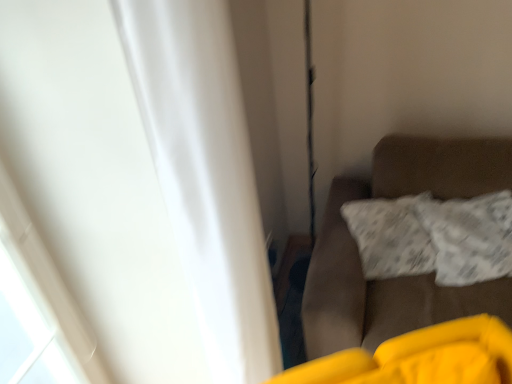
Question: Is white matte curtain at left facing away from brown fabric couch at right?

Choices:
 (A) no
 (B) yes

Answer: (A)

Question: Does white matte curtain at left have a smaller size compared to brown fabric couch at right?

Choices:
 (A) yes
 (B) no

Answer: (A)

Question: From the image's perspective, is white matte curtain at left beneath brown fabric couch at right?

Choices:
 (A) no
 (B) yes

Answer: (A)

Question: Is white matte curtain at left positioned far away from brown fabric couch at right?

Choices:
 (A) no
 (B) yes

Answer: (A)

Question: Is white matte curtain at left shorter than brown fabric couch at right?

Choices:
 (A) yes
 (B) no

Answer: (B)

Question: Is white textured pillow at right to the left or to the right of brown fabric couch at right in the image?

Choices:
 (A) right
 (B) left

Answer: (A)

Question: From a real-world perspective, is white textured pillow at right physically located above or below brown fabric couch at right?

Choices:
 (A) above
 (B) below

Answer: (A)

Question: Looking at the image, does white textured pillow at right seem bigger or smaller compared to brown fabric couch at right?

Choices:
 (A) small
 (B) big

Answer: (A)

Question: Looking at their shapes, would you say white textured pillow at right is wider or thinner than brown fabric couch at right?

Choices:
 (A) thin
 (B) wide

Answer: (A)

Question: Considering the positions of point (270, 299) and point (501, 299), is point (270, 299) closer or farther from the camera than point (501, 299)?

Choices:
 (A) closer
 (B) farther

Answer: (A)

Question: In the image, is white matte curtain at left positioned in front of or behind brown fabric couch at right?

Choices:
 (A) front
 (B) behind

Answer: (A)

Question: Is white matte curtain at left bigger or smaller than brown fabric couch at right?

Choices:
 (A) big
 (B) small

Answer: (B)

Question: Is white matte curtain at left taller or shorter than brown fabric couch at right?

Choices:
 (A) tall
 (B) short

Answer: (A)

Question: Is brown fabric couch at right to the left or to the right of white textured pillow at right in the image?

Choices:
 (A) left
 (B) right

Answer: (A)

Question: Based on their sizes in the image, would you say brown fabric couch at right is bigger or smaller than white textured pillow at right?

Choices:
 (A) small
 (B) big

Answer: (B)